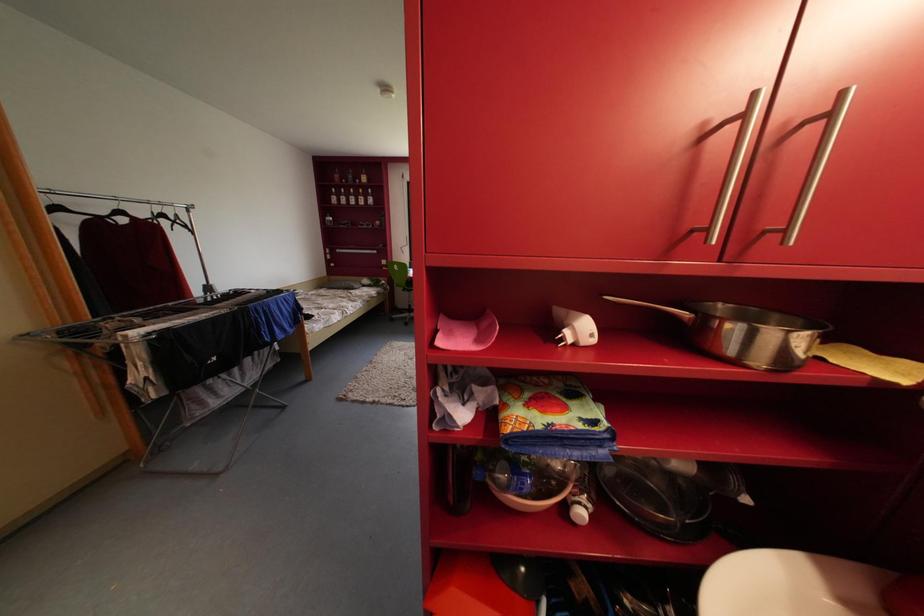
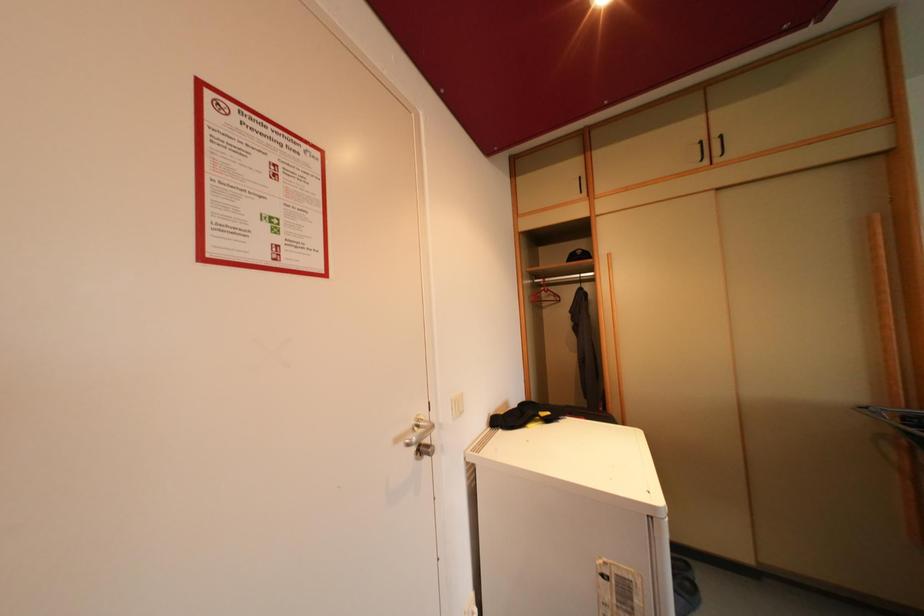
Question: The camera is either moving clockwise (left) or counter-clockwise (right) around the object. The first image is from the beginning of the video and the second image is from the end. Is the camera moving left or right when shooting the video?

Choices:
 (A) Left
 (B) Right

Answer: (B)